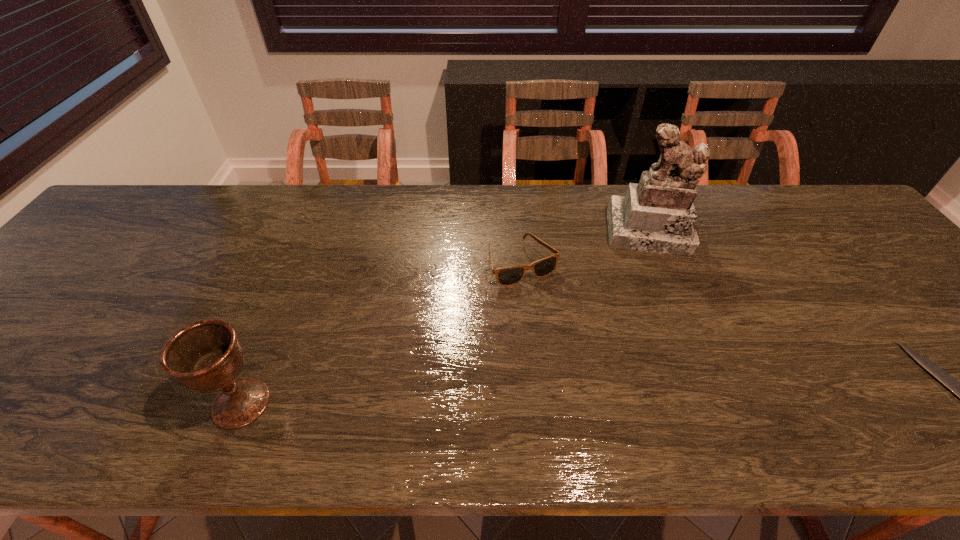
Where is `vacant area located on the front-facing side of the figurine`? vacant area located on the front-facing side of the figurine is located at coordinates (658, 307).

I want to click on vacant position located on the front-facing side of the figurine, so click(660, 323).

The height and width of the screenshot is (540, 960). What are the coordinates of `vacant position located 0.100m on the front-facing side of the figurine` in the screenshot? It's located at (655, 283).

What are the coordinates of `object that is at the far edge` in the screenshot? It's located at (657, 215).

At what (x,y) coordinates should I click in order to perform the action: click on object positioned at the near edge. Please return your answer as a coordinate pair (x, y). The image size is (960, 540). Looking at the image, I should click on (206, 356).

In the image, there is a desktop. Find the location of `vacant space at the far edge`. vacant space at the far edge is located at coordinates (583, 188).

The height and width of the screenshot is (540, 960). I want to click on vacant space at the near edge of the desktop, so click(x=645, y=367).

I want to click on free space at the left edge of the desktop, so click(x=64, y=265).

Where is `free point at the right edge`? The height and width of the screenshot is (540, 960). free point at the right edge is located at coordinates (x=850, y=249).

In the image, there is a desktop. Where is `free space at the far left corner`? The width and height of the screenshot is (960, 540). free space at the far left corner is located at coordinates (109, 217).